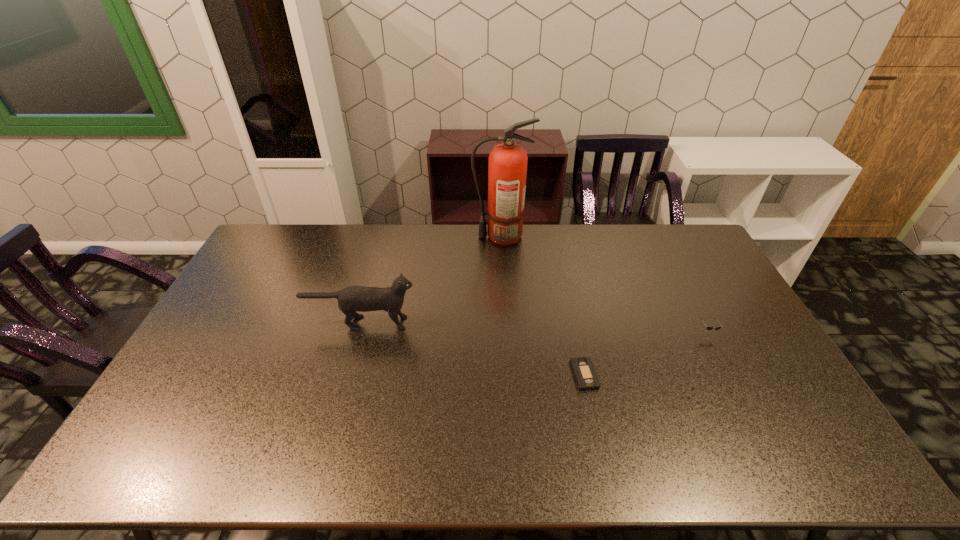
At what (x,y) coordinates should I click in order to perform the action: click on free space between the tallest object and the rightmost object. Please return your answer as a coordinate pair (x, y). Image resolution: width=960 pixels, height=540 pixels. Looking at the image, I should click on (604, 284).

Where is `free space between the leftmost object and the nearest object`? The image size is (960, 540). free space between the leftmost object and the nearest object is located at coordinates (473, 349).

Where is `object that stands as the third closest to the sunglasses`? The width and height of the screenshot is (960, 540). object that stands as the third closest to the sunglasses is located at coordinates pyautogui.click(x=355, y=298).

Locate an element on the screen. This screenshot has height=540, width=960. object that can be found as the closest to the shortest object is located at coordinates (708, 327).

Identify the location of vacant space that satisfies the following two spatial constraints: 1. on the nozzle of the fire extinguisher; 2. on the right side of the videotape. (509, 375).

Where is `vacant area in the image that satisfies the following two spatial constraints: 1. on the front-facing side of the leftmost object; 2. on the back side of the third object from left to right`? vacant area in the image that satisfies the following two spatial constraints: 1. on the front-facing side of the leftmost object; 2. on the back side of the third object from left to right is located at coordinates (348, 375).

This screenshot has width=960, height=540. In order to click on free space that satisfies the following two spatial constraints: 1. on the nozzle of the farthest object; 2. on the left side of the nearest object in this screenshot , I will do `click(509, 375)`.